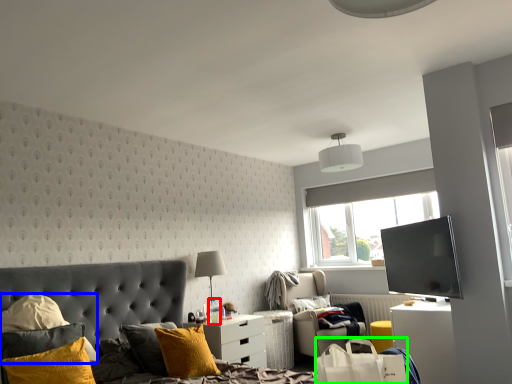
Question: Which object is positioned farthest from bottle (highlighted by a red box)? Select from pillow (highlighted by a blue box) and shopping bag (highlighted by a green box).

Choices:
 (A) pillow
 (B) shopping bag

Answer: (B)